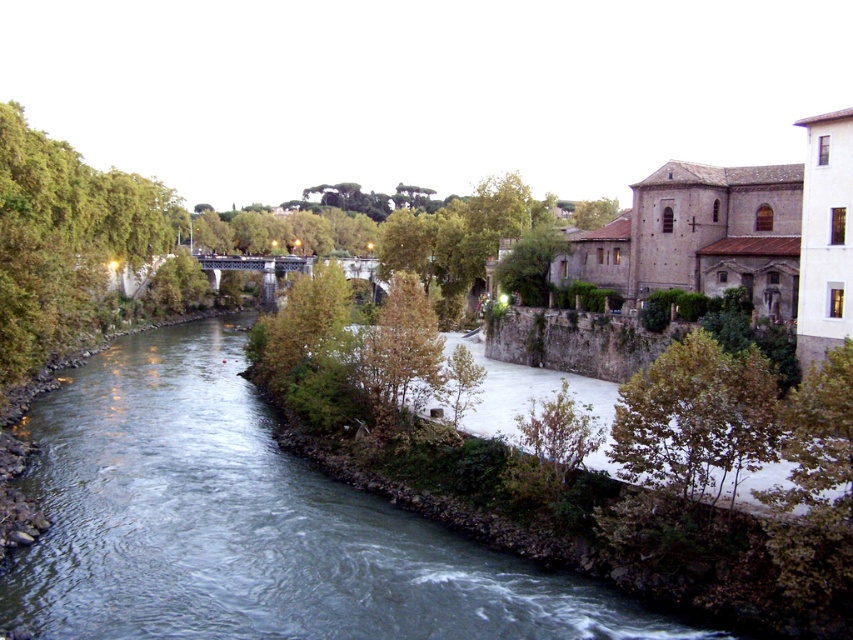
You are standing at the center of the image and want to walk towards the green leafy tree at lower right. Which direction should you go to avoid the green leafy tree at left?

To avoid the green leafy tree at left, you should walk towards the right side since the green leafy tree at left is positioned to the left of the green leafy tree at lower right.

You are a photographer planning to capture the reflection of the green matte tree at center in the clear water at center. Based on the scene described, will the reflection be visible?

The clear water at center is positioned under green matte tree at center, so the reflection of the green matte tree at center should be visible in the clear water at center since the water is clear and the tree is directly above it.